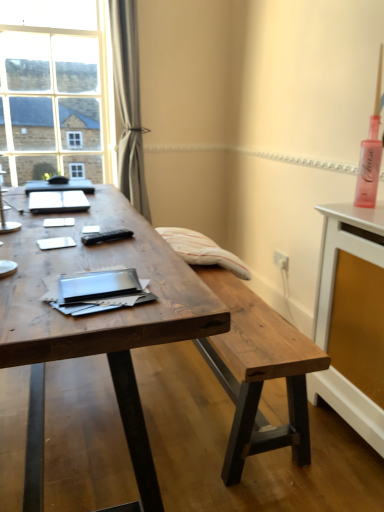
Question: Is satin gray curtain at upper left shorter than wooden desk at center?

Choices:
 (A) no
 (B) yes

Answer: (A)

Question: Does satin gray curtain at upper left appear on the right side of wooden desk at center?

Choices:
 (A) no
 (B) yes

Answer: (B)

Question: Is satin gray curtain at upper left next to wooden desk at center?

Choices:
 (A) yes
 (B) no

Answer: (B)

Question: Is satin gray curtain at upper left located outside wooden desk at center?

Choices:
 (A) no
 (B) yes

Answer: (B)

Question: Does satin gray curtain at upper left have a greater height compared to wooden desk at center?

Choices:
 (A) no
 (B) yes

Answer: (B)

Question: In the image, is satin gray curtain at upper left positioned in front of or behind clear glass window at upper left?

Choices:
 (A) front
 (B) behind

Answer: (A)

Question: From the image's perspective, relative to clear glass window at upper left, is satin gray curtain at upper left above or below?

Choices:
 (A) above
 (B) below

Answer: (B)

Question: Is satin gray curtain at upper left wider or thinner than clear glass window at upper left?

Choices:
 (A) wide
 (B) thin

Answer: (A)

Question: Looking at the image, does satin gray curtain at upper left seem bigger or smaller compared to clear glass window at upper left?

Choices:
 (A) big
 (B) small

Answer: (B)

Question: Is satin gray curtain at upper left wider or thinner than rustic wood bench at center?

Choices:
 (A) thin
 (B) wide

Answer: (A)

Question: Considering the positions of satin gray curtain at upper left and rustic wood bench at center in the image, is satin gray curtain at upper left taller or shorter than rustic wood bench at center?

Choices:
 (A) short
 (B) tall

Answer: (B)

Question: Considering their positions, is satin gray curtain at upper left located in front of or behind rustic wood bench at center?

Choices:
 (A) front
 (B) behind

Answer: (B)

Question: Is satin gray curtain at upper left bigger or smaller than rustic wood bench at center?

Choices:
 (A) big
 (B) small

Answer: (B)

Question: Do you think white glossy sideboard at right is within wooden desk at center, or outside of it?

Choices:
 (A) inside
 (B) outside

Answer: (B)

Question: Visually, is white glossy sideboard at right positioned to the left or to the right of wooden desk at center?

Choices:
 (A) left
 (B) right

Answer: (B)